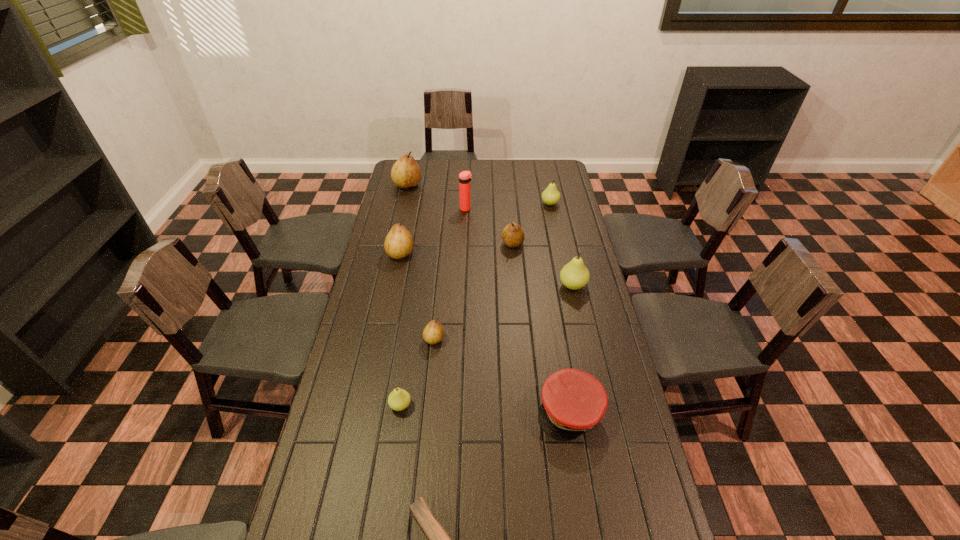
The image size is (960, 540). Find the location of `vacant space situated 0.160m on the front of the farthest green pear`. vacant space situated 0.160m on the front of the farthest green pear is located at coordinates (555, 229).

You are a GUI agent. You are given a task and a screenshot of the screen. Output one action in this format:
    pyautogui.click(x=<x>, y=<y>)
    Task: Click on the free space located on the left of the fourth pear from right to left
    Image resolution: width=960 pixels, height=540 pixels.
    Given the screenshot: What is the action you would take?
    pyautogui.click(x=369, y=339)

Where is `vacant point located on the front of the fifth pear from right to left`? The height and width of the screenshot is (540, 960). vacant point located on the front of the fifth pear from right to left is located at coordinates (388, 489).

Identify the location of free location located 0.170m on the front-facing side of the red cap. (586, 505).

At what (x,y) coordinates should I click in order to perform the action: click on object that is at the far edge. Please return your answer as a coordinate pair (x, y). This screenshot has height=540, width=960. Looking at the image, I should click on (405, 173).

Where is `cap present at the right edge`? cap present at the right edge is located at coordinates (574, 401).

Image resolution: width=960 pixels, height=540 pixels. I want to click on object at the far left corner, so pos(405,173).

Find the location of a particular element. The width and height of the screenshot is (960, 540). free space at the far edge of the desktop is located at coordinates (532, 162).

This screenshot has height=540, width=960. Find the location of `vacant space at the left edge of the desktop`. vacant space at the left edge of the desktop is located at coordinates (396, 271).

The image size is (960, 540). Find the location of `vacant area at the right edge of the desktop`. vacant area at the right edge of the desktop is located at coordinates (609, 414).